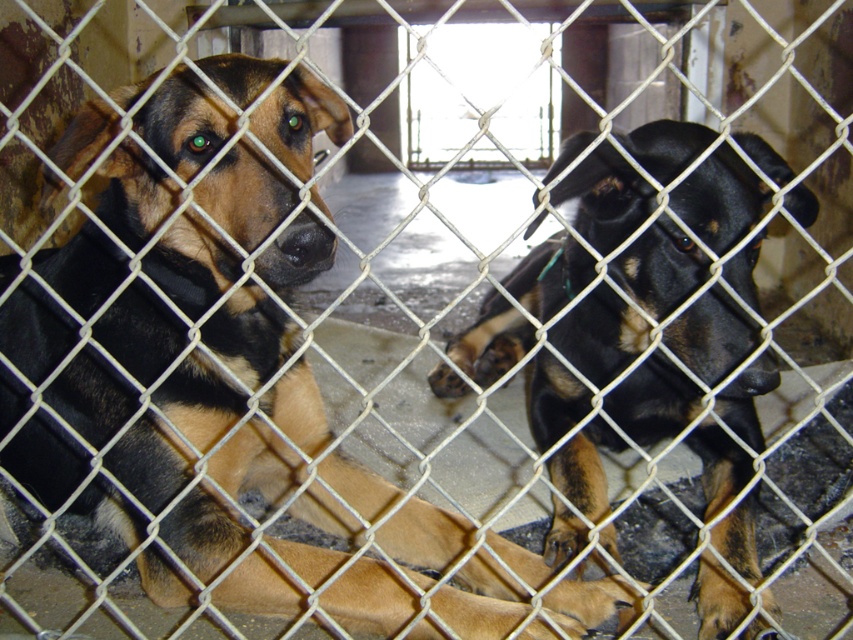
You are a dog trainer observing two dogs in a kennel. You notice the black fur dog at left and the black glossy dog at center. Which dog is positioned closer to the front of the kennel?

The black fur dog at left is closer to the viewer than the black glossy dog at center, so the black fur dog at left is positioned closer to the front of the kennel.